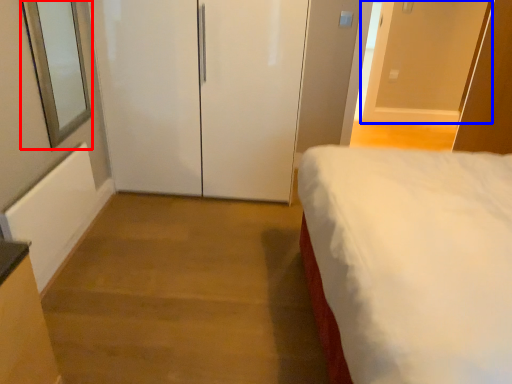
Question: Among these objects, which one is nearest to the camera, window screen (highlighted by a red box) or door (highlighted by a blue box)?

Choices:
 (A) window screen
 (B) door

Answer: (A)